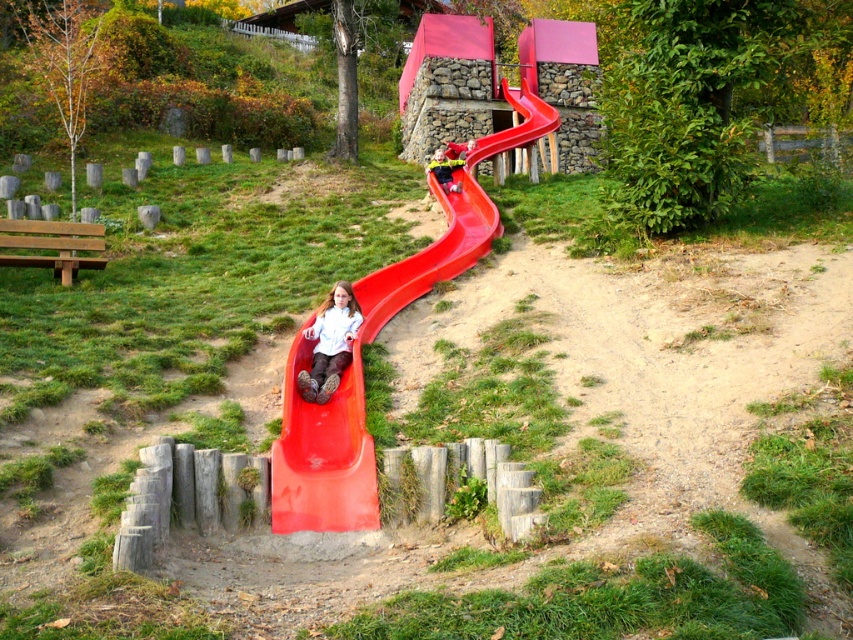
Question: Is smooth plastic slide at lower left positioned before matte white shirt at center?

Choices:
 (A) no
 (B) yes

Answer: (B)

Question: Estimate the real-world distances between objects in this image. Which object is closer to the matte white shirt at center?

Choices:
 (A) smooth plastic slide at lower left
 (B) matte red slide at center

Answer: (A)

Question: Does matte white shirt at center have a smaller size compared to matte red slide at center?

Choices:
 (A) yes
 (B) no

Answer: (B)

Question: Observing the image, what is the correct spatial positioning of matte white shirt at center in reference to matte red slide at center?

Choices:
 (A) above
 (B) below

Answer: (B)

Question: Which object is positioned closest to the matte red slide at center?

Choices:
 (A) smooth plastic slide at lower left
 (B) matte white shirt at center

Answer: (A)

Question: Which of the following is the closest to the observer?

Choices:
 (A) smooth plastic slide at lower left
 (B) matte white shirt at center

Answer: (A)